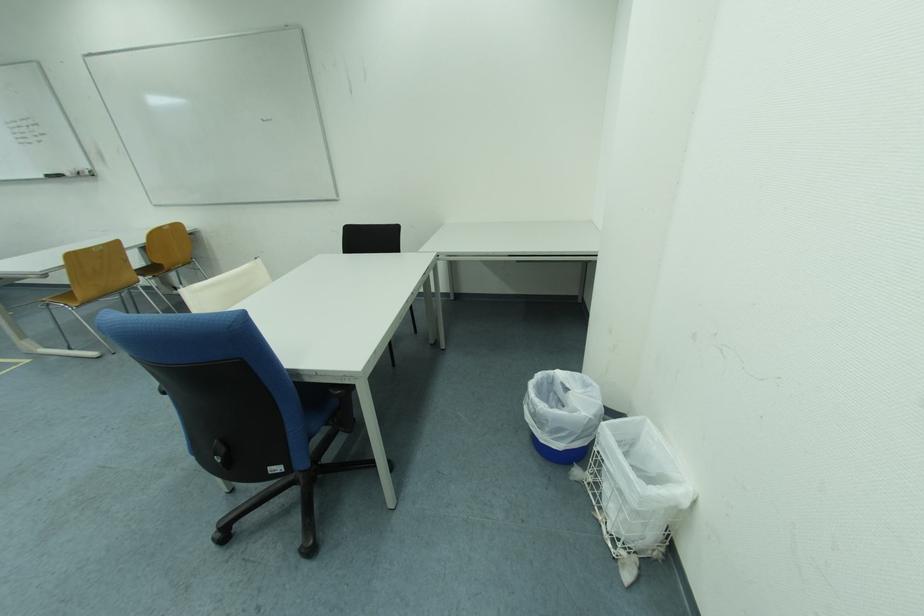
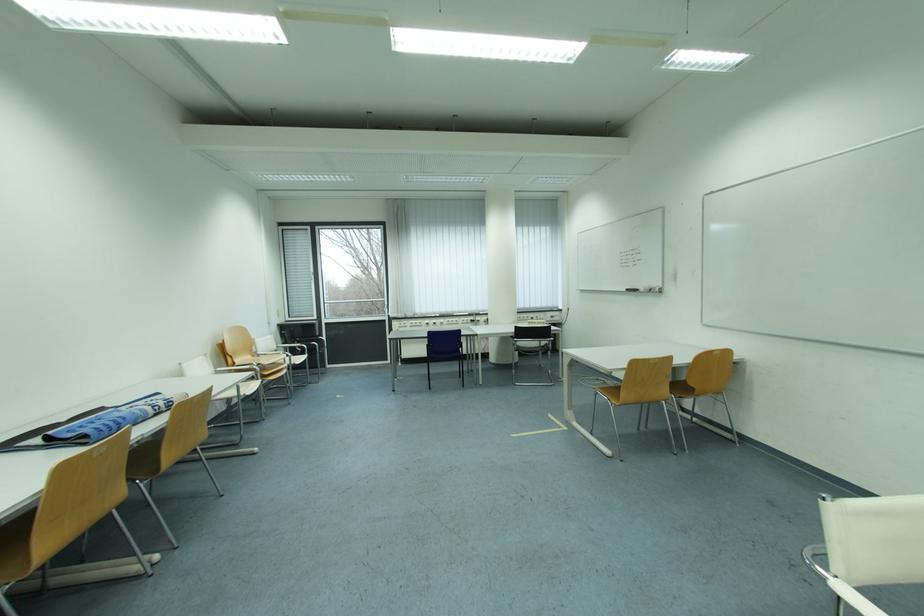
Question: Based on the continuous images, in which direction is the camera rotating? Reply with the corresponding letter.

Choices:
 (A) Left
 (B) Right
 (C) Up
 (D) Down

Answer: (A)